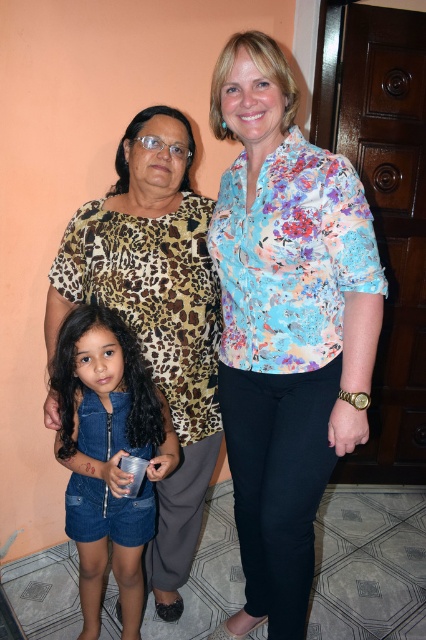
Which is more to the right, floral print blouse at center or leopard print blouse at center?

From the viewer's perspective, floral print blouse at center appears more on the right side.

Is floral print blouse at center positioned before leopard print blouse at center?

That is True.

Is point (275, 259) positioned in front of point (213, 275)?

Yes, it is.

Locate an element on the screen. The image size is (426, 640). floral print blouse at center is located at coordinates (285, 324).

Is floral print blouse at center shorter than denim romper at lower left?

No, floral print blouse at center is not shorter than denim romper at lower left.

This screenshot has height=640, width=426. Find the location of `floral print blouse at center`. floral print blouse at center is located at coordinates (285, 324).

The image size is (426, 640). What are the coordinates of `floral print blouse at center` in the screenshot? It's located at (285, 324).

Where is `floral print blouse at center`? The width and height of the screenshot is (426, 640). floral print blouse at center is located at coordinates (285, 324).

Which of these two, leopard print blouse at center or denim romper at lower left, stands shorter?

Standing shorter between the two is denim romper at lower left.

Which is more to the left, leopard print blouse at center or denim romper at lower left?

Positioned to the left is denim romper at lower left.

This screenshot has height=640, width=426. Describe the element at coordinates (155, 314) in the screenshot. I see `leopard print blouse at center` at that location.

What are the coordinates of `leopard print blouse at center` in the screenshot? It's located at (155, 314).